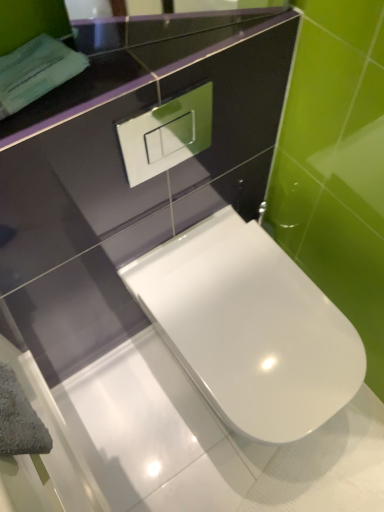
You are a GUI agent. You are given a task and a screenshot of the screen. Output one action in this format:
    pyautogui.click(x=<x>, y=<y>)
    Task: Click on the glossy black mirror at upper center
    
    Given the screenshot: What is the action you would take?
    (x=161, y=28)

What do you see at coordinates (161, 28) in the screenshot?
I see `glossy black mirror at upper center` at bounding box center [161, 28].

Find the location of `white glossy toilet at center`. white glossy toilet at center is located at coordinates (249, 328).

The image size is (384, 512). What do you see at coordinates (249, 328) in the screenshot?
I see `white glossy toilet at center` at bounding box center [249, 328].

Find the location of a particular element. glossy black mirror at upper center is located at coordinates (161, 28).

Can you confirm if glossy black mirror at upper center is positioned to the right of white glossy toilet at center?

Incorrect, glossy black mirror at upper center is not on the right side of white glossy toilet at center.

Relative to white glossy toilet at center, is glossy black mirror at upper center in front or behind?

Clearly, glossy black mirror at upper center is in front of white glossy toilet at center.

Considering the points (136, 46) and (218, 388), which point is behind, point (136, 46) or point (218, 388)?

Positioned behind is point (218, 388).

Based on the photo, from the image's perspective, would you say glossy black mirror at upper center is positioned over white glossy toilet at center?

Correct, glossy black mirror at upper center appears higher than white glossy toilet at center in the image.

Looking at this image, from a real-world perspective, is glossy black mirror at upper center physically located above or below white glossy toilet at center?

Clearly, from a real-world perspective, glossy black mirror at upper center is above white glossy toilet at center.

Does glossy black mirror at upper center have a greater width compared to white glossy toilet at center?

In fact, glossy black mirror at upper center might be narrower than white glossy toilet at center.

Is glossy black mirror at upper center shorter than white glossy toilet at center?

Yes.

Is glossy black mirror at upper center smaller than white glossy toilet at center?

Indeed, glossy black mirror at upper center has a smaller size compared to white glossy toilet at center.

Is glossy black mirror at upper center spatially inside white glossy toilet at center, or outside of it?

glossy black mirror at upper center is not inside white glossy toilet at center, it's outside.

Is glossy black mirror at upper center next to white glossy toilet at center?

glossy black mirror at upper center and white glossy toilet at center are not in contact.

Is glossy black mirror at upper center oriented away from white glossy toilet at center?

No, glossy black mirror at upper center is not facing the opposite direction of white glossy toilet at center.

Where is `mirror lying on the left of white glossy toilet at center`? The width and height of the screenshot is (384, 512). mirror lying on the left of white glossy toilet at center is located at coordinates (161, 28).

Does white glossy toilet at center appear on the left side of glossy black mirror at upper center?

No, white glossy toilet at center is not to the left of glossy black mirror at upper center.

Based on the photo, who is more distant, white glossy toilet at center or glossy black mirror at upper center?

white glossy toilet at center is behind.

Is point (231, 221) positioned after point (236, 33)?

Yes, point (231, 221) is farther from viewer.

From the image's perspective, is white glossy toilet at center positioned above or below glossy black mirror at upper center?

From the image's perspective, white glossy toilet at center appears below glossy black mirror at upper center.

From a real-world perspective, is white glossy toilet at center positioned under glossy black mirror at upper center based on gravity?

Yes.

Does white glossy toilet at center have a greater width compared to glossy black mirror at upper center?

Yes, white glossy toilet at center is wider than glossy black mirror at upper center.

Considering the sizes of objects white glossy toilet at center and glossy black mirror at upper center in the image provided, who is shorter, white glossy toilet at center or glossy black mirror at upper center?

glossy black mirror at upper center.

Does white glossy toilet at center have a smaller size compared to glossy black mirror at upper center?

No, white glossy toilet at center is not smaller than glossy black mirror at upper center.

Is glossy black mirror at upper center completely or partially inside white glossy toilet at center?

No, white glossy toilet at center does not contain glossy black mirror at upper center.

Is white glossy toilet at center with glossy black mirror at upper center?

They are not placed beside each other.

Does white glossy toilet at center turn towards glossy black mirror at upper center?

No, white glossy toilet at center is not turned towards glossy black mirror at upper center.

Find the location of a particular element. This screenshot has width=384, height=512. mirror located above the white glossy toilet at center (from the image's perspective) is located at coordinates (161, 28).

Identify the location of mirror on the left of white glossy toilet at center. The height and width of the screenshot is (512, 384). (161, 28).

You are a GUI agent. You are given a task and a screenshot of the screen. Output one action in this format:
    pyautogui.click(x=<x>, y=<y>)
    Task: Click on the mirror located above the white glossy toilet at center (from a real-world perspective)
    
    Given the screenshot: What is the action you would take?
    pyautogui.click(x=161, y=28)